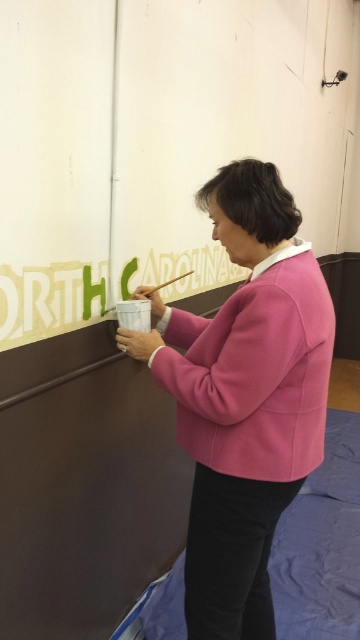
You are standing in front of the wall with the partially painted letters. You need to reach the wooden paintbrush at upper center to continue painting. Is the pink woolen sweater at center blocking your access to the paintbrush?

The pink woolen sweater at center is closer to the viewer than the wooden paintbrush at upper center, so it is blocking the access to the paintbrush.

Consider the image. You are a painter who needs to reach the wooden paintbrush at upper center to continue painting the wall. However, there is a matte pink sweatshirt at center in the way. Can you move the sweatshirt to access the paintbrush?

The matte pink sweatshirt at center is positioned under the wooden paintbrush at upper center, so you can move the sweatshirt to access the paintbrush.